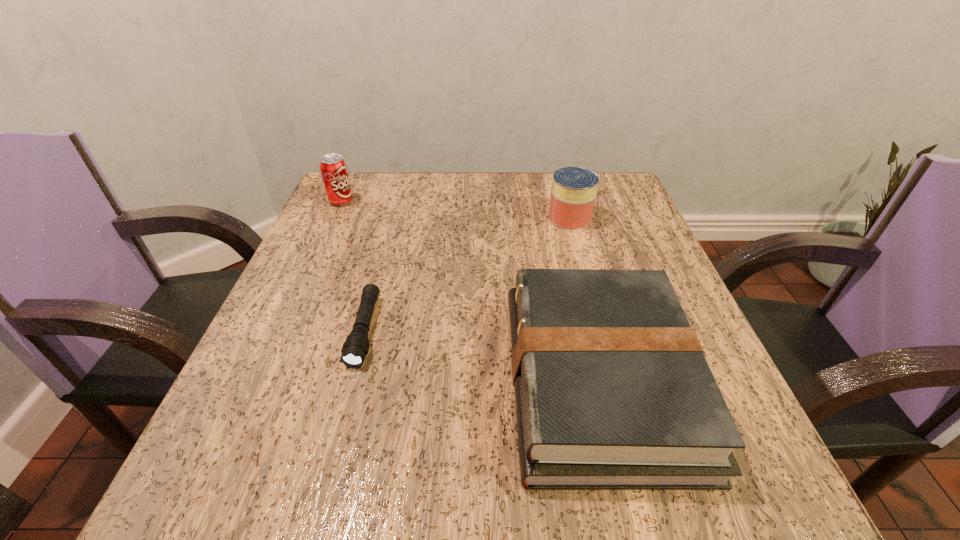
This screenshot has width=960, height=540. Identify the location of the leftmost object. (333, 167).

At what (x,y) coordinates should I click in order to perform the action: click on can. Please return your answer as a coordinate pair (x, y). This screenshot has height=540, width=960. Looking at the image, I should click on (574, 189).

Identify the location of hardback book. (612, 389).

This screenshot has height=540, width=960. In order to click on flashlight in this screenshot , I will do `click(355, 348)`.

The height and width of the screenshot is (540, 960). Find the location of `the shortest object`. the shortest object is located at coordinates (355, 348).

Locate an element on the screen. vacant space located on the back of the soda is located at coordinates (348, 185).

Where is `free space located 0.080m on the left of the can`? free space located 0.080m on the left of the can is located at coordinates (514, 218).

The height and width of the screenshot is (540, 960). In order to click on free spot located 0.330m on the spine side of the hardback book in this screenshot , I will do `click(298, 380)`.

Locate an element on the screen. Image resolution: width=960 pixels, height=540 pixels. vacant space located 0.080m on the spine side of the hardback book is located at coordinates 460,380.

Locate an element on the screen. Image resolution: width=960 pixels, height=540 pixels. vacant space located on the spine side of the hardback book is located at coordinates (343, 380).